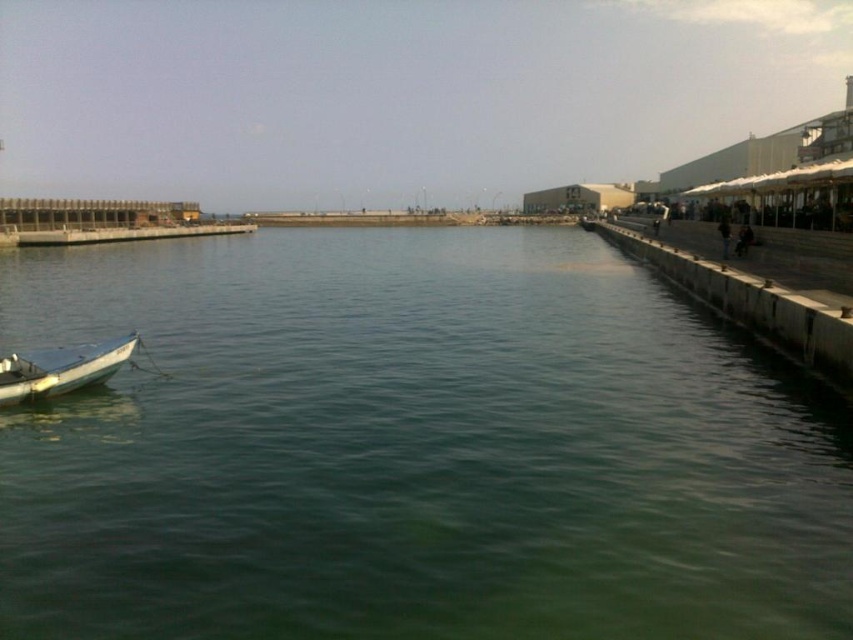
You are planning to host a small gathering and need to choose between the concrete at right and the white matte boat at left for seating. Based on the scene, which location offers more space for seating?

The concrete at right is larger in size than the white matte boat at left, so it offers more space for seating.

You are standing at the point marked by coordinates point (x=355, y=228) in the waterfront scene. If you want to take a photo of the entire waterfront, including the small white boat on the left and the concrete pier on the right, would your current position allow you to capture the entire scene in one shot without moving? Please explain using the distance between you and the camera.

The point (x=355, y=228) is 150.95 meters away from the camera. Since the camera needs to capture the entire waterfront scene including both the small white boat on the left and the concrete pier on the right, being 150.95 meters away might provide enough distance to include all elements in the frame. However, this depends on the camera lens and sensor size. Assuming standard equipment, this distance should allow capturing the entire scene without needing to move.

You are planning to place a small floating dock that is 2 meters wide in the center of the image. Given the scene, will the green water at center have enough space to accommodate the dock without overlapping the white matte boat at left?

The green water at center has a larger width than the white matte boat at left according to the description, so it should have sufficient space to accommodate the 2 meter wide dock without overlapping the boat.